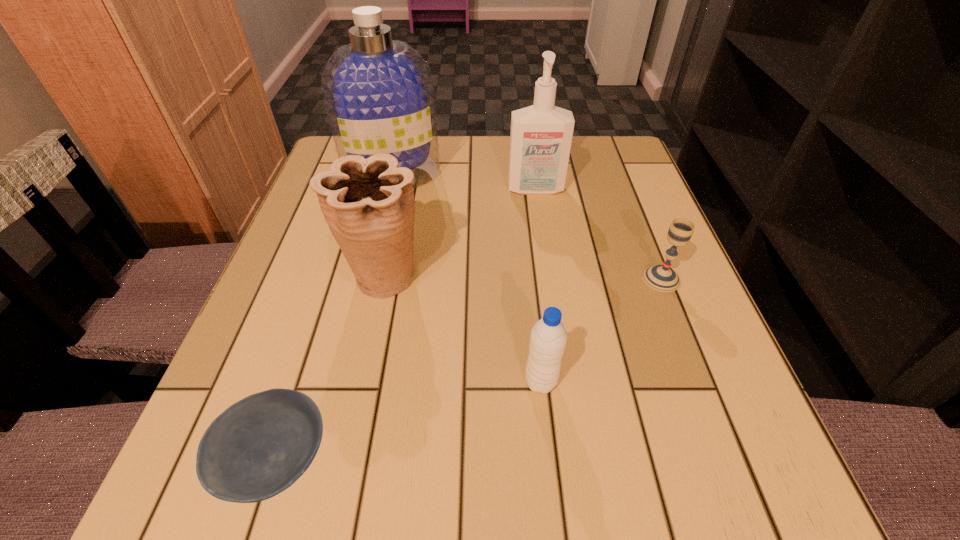
I want to click on the tallest object, so click(x=378, y=92).

Where is `the left cleansing agent`? The height and width of the screenshot is (540, 960). the left cleansing agent is located at coordinates (378, 92).

The height and width of the screenshot is (540, 960). I want to click on the fifth shortest object, so 540,141.

Locate an element on the screen. This screenshot has height=540, width=960. the shorter cleansing agent is located at coordinates coord(540,141).

Where is `the fourth shortest object`? The height and width of the screenshot is (540, 960). the fourth shortest object is located at coordinates (368, 204).

Find the location of a particular element. the fourth tallest object is located at coordinates (548, 338).

Find the location of `the second nearest object`. the second nearest object is located at coordinates (548, 338).

I want to click on the rightmost object, so click(662, 278).

Locate an element on the screen. chalice is located at coordinates (662, 278).

Find the location of a particular element. the shortest object is located at coordinates (258, 447).